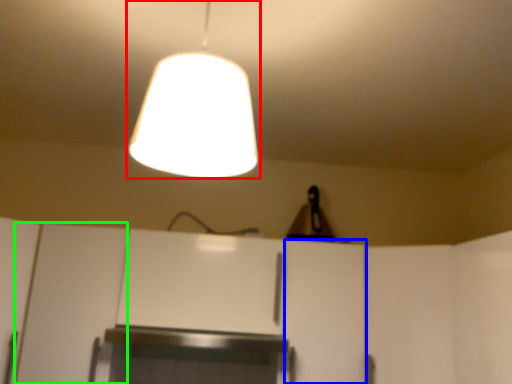
Question: Which object is the farthest from lamp (highlighted by a red box)? Choose among these: cabinetry (highlighted by a blue box) or cabinetry (highlighted by a green box).

Choices:
 (A) cabinetry
 (B) cabinetry

Answer: (B)